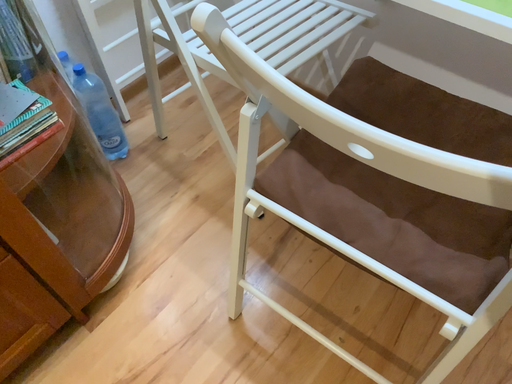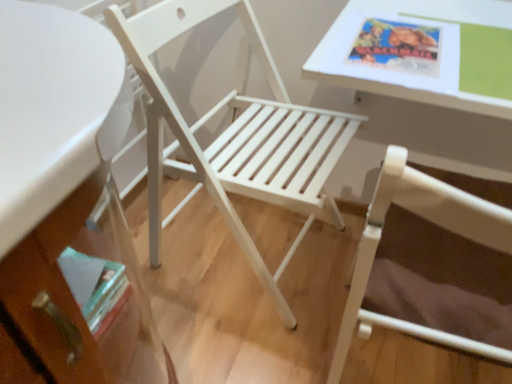
Question: Which way did the camera rotate in the video?

Choices:
 (A) rotated upward
 (B) rotated downward

Answer: (A)